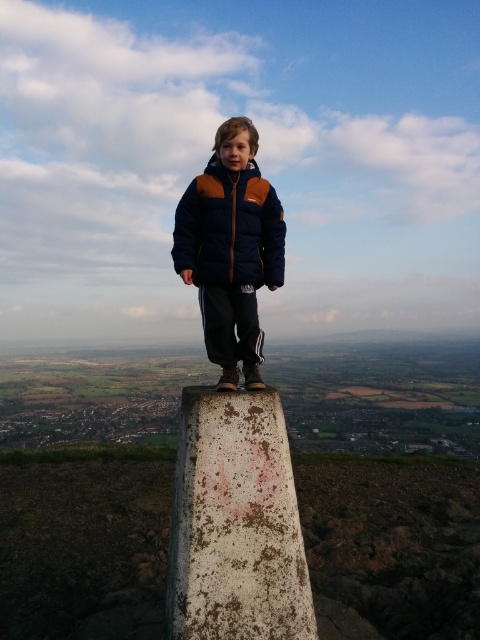
Question: Where is white weathered stone at center located in relation to navy blue down jacket at center in the image?

Choices:
 (A) below
 (B) above

Answer: (A)

Question: Which point is farther to the camera?

Choices:
 (A) 242,403
 (B) 282,236

Answer: (B)

Question: Is white weathered stone at center further to the viewer compared to navy blue down jacket at center?

Choices:
 (A) no
 (B) yes

Answer: (A)

Question: Can you confirm if white weathered stone at center is positioned above navy blue down jacket at center?

Choices:
 (A) yes
 (B) no

Answer: (B)

Question: Among these points, which one is farthest from the camera?

Choices:
 (A) (285, 636)
 (B) (266, 221)

Answer: (B)

Question: Which point is farther from the camera taking this photo?

Choices:
 (A) (225, 193)
 (B) (260, 417)

Answer: (A)